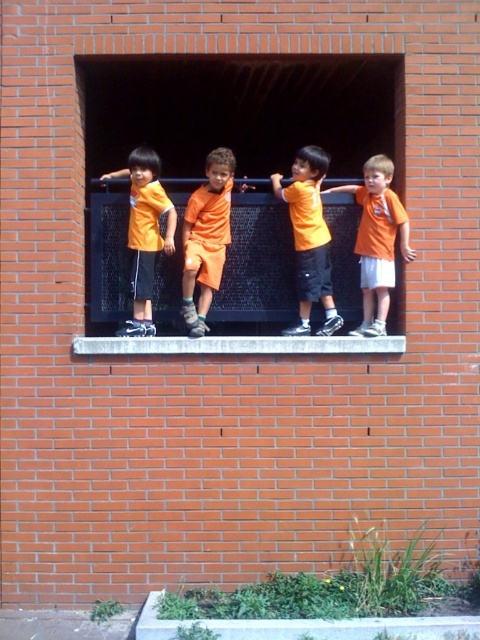
Does orange matte shorts at center appear on the right side of white stone at center?

Incorrect, orange matte shorts at center is not on the right side of white stone at center.

Who is positioned more to the left, orange matte shorts at center or white stone at center?

Positioned to the left is orange matte shorts at center.

Is point (227, 147) closer to viewer compared to point (384, 353)?

That is False.

Where is `orange matte shorts at center`? orange matte shorts at center is located at coordinates (206, 237).

Is orange matte shirt at center closer to camera compared to white stone at center?

That is False.

Can you confirm if orange matte shirt at center is positioned below white stone at center?

Incorrect, orange matte shirt at center is not positioned below white stone at center.

Does point (311, 225) lie behind point (348, 337)?

Yes, point (311, 225) is farther from viewer.

I want to click on orange matte shirt at center, so click(310, 237).

Can you confirm if concrete at center is smaller than orange matte shirt at center?

No.

Who is higher up, concrete at center or orange matte shirt at center?

orange matte shirt at center is higher up.

What do you see at coordinates (309, 627) in the screenshot? I see `concrete at center` at bounding box center [309, 627].

Locate an element on the screen. This screenshot has width=480, height=640. concrete at center is located at coordinates (309, 627).